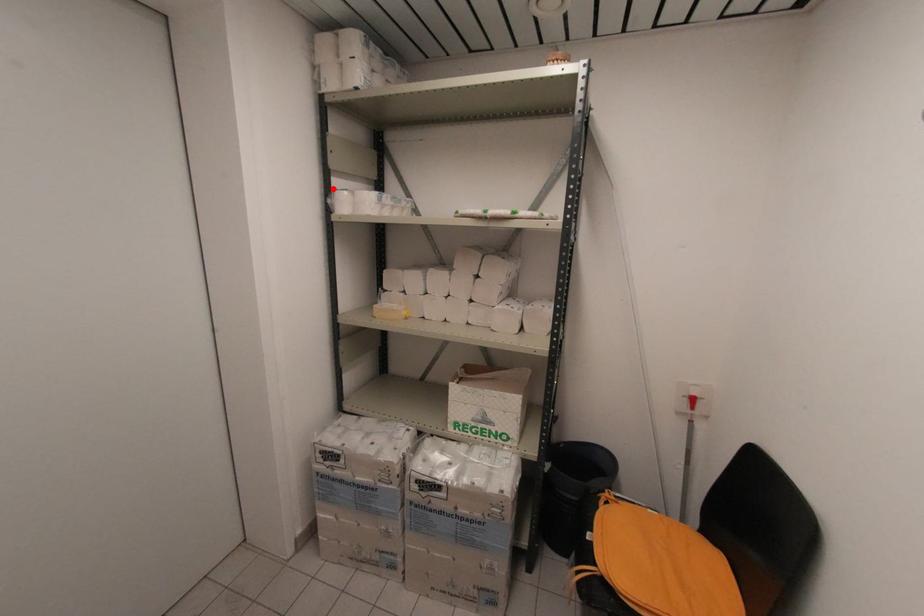
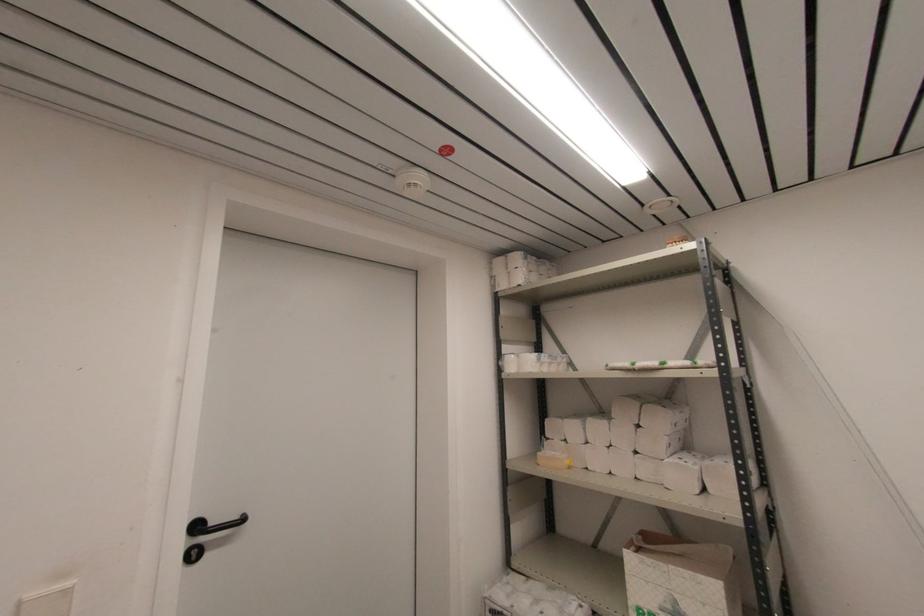
Question: I am providing you with two images of the same scene from different viewpoints. A red point is shown in image1. For the corresponding object point in image2, is it positioned nearer or farther from the camera?

Choices:
 (A) Nearer
 (B) Farther

Answer: (B)